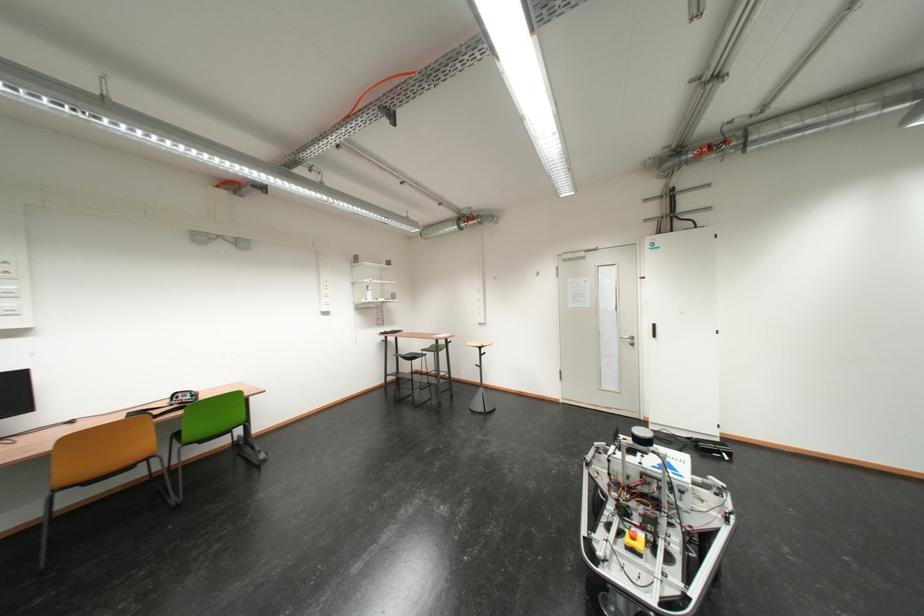
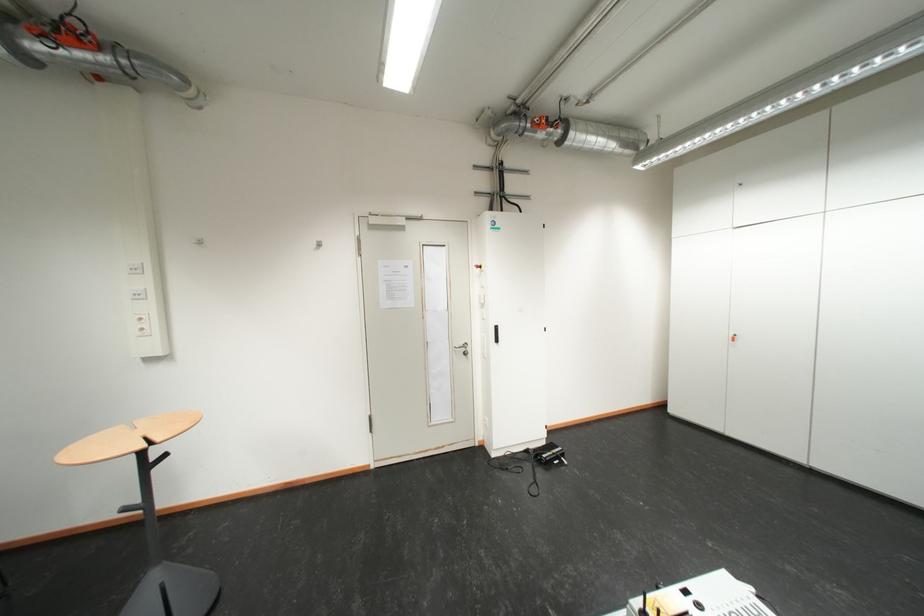
Locate, in the second image, the point that corresponds to point (700, 440) in the first image.

(538, 454)